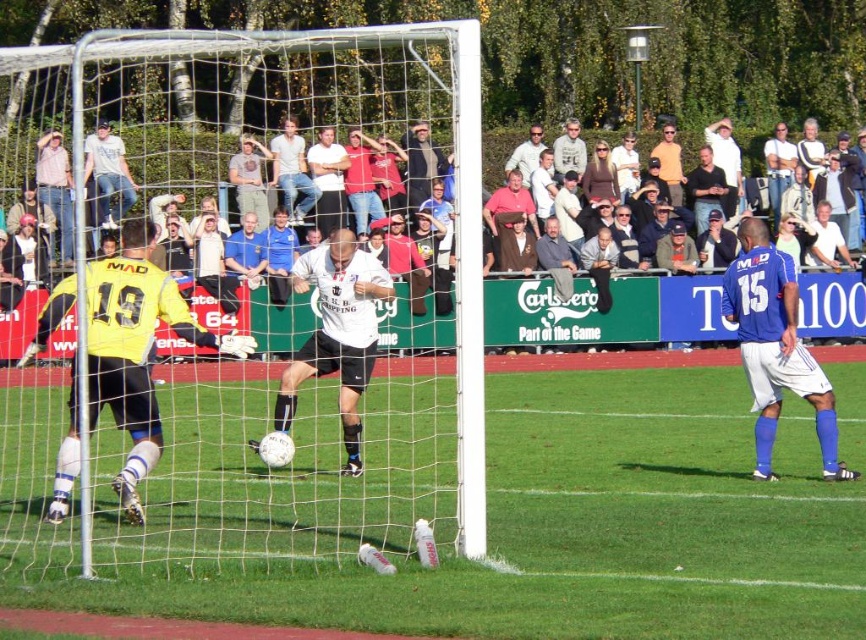
Question: Can you confirm if green grass at center is thinner than white matte jersey at center?

Choices:
 (A) no
 (B) yes

Answer: (A)

Question: Considering the relative positions of green grass at center and blue jersey at right in the image provided, where is green grass at center located with respect to blue jersey at right?

Choices:
 (A) right
 (B) left

Answer: (B)

Question: Can you confirm if white mesh net at center is bigger than white matte jersey at center?

Choices:
 (A) yes
 (B) no

Answer: (A)

Question: Which object is farther from the camera taking this photo?

Choices:
 (A) blue jersey at right
 (B) white matte jersey at center

Answer: (B)

Question: Which point is closer to the camera?

Choices:
 (A) white mesh net at center
 (B) blue jersey at right

Answer: (A)

Question: Which point appears closest to the camera in this image?

Choices:
 (A) tap(598, 598)
 (B) tap(740, 292)
 (C) tap(328, 301)

Answer: (A)